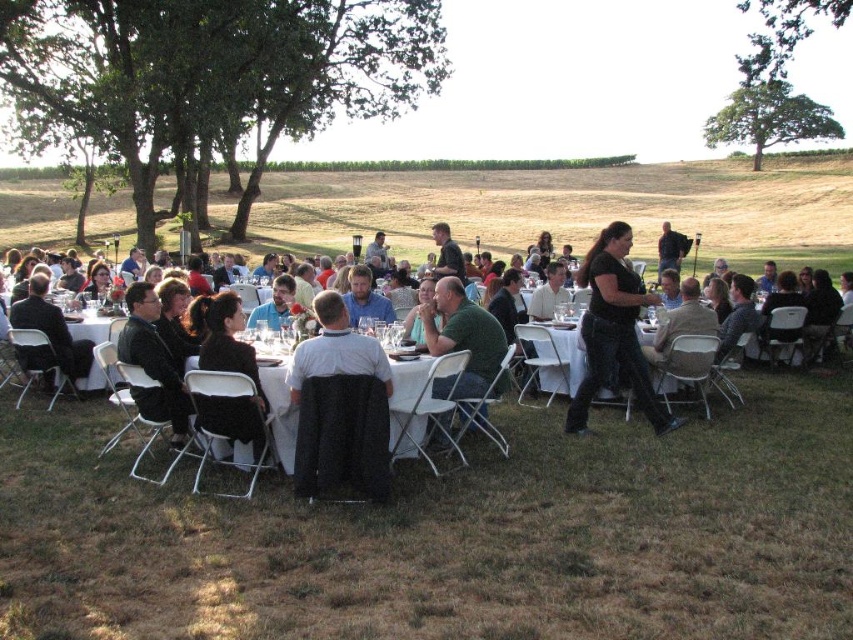
You are organizing a small outdoor event and have two items at the center of the scene to arrange. You need to place both the black textured jacket at center and the black fabric dress at center on a narrow shelf. Which item should you place first to ensure both fit on the shelf?

→ The black textured jacket at center occupies less space than the black fabric dress at center. Therefore, you should place the black fabric dress at center first, leaving the smaller space for the jacket to ensure both fit on the narrow shelf.

You are standing at the point marked as point (x=340, y=406). What object are you touching?

You are touching the black textured jacket at center.